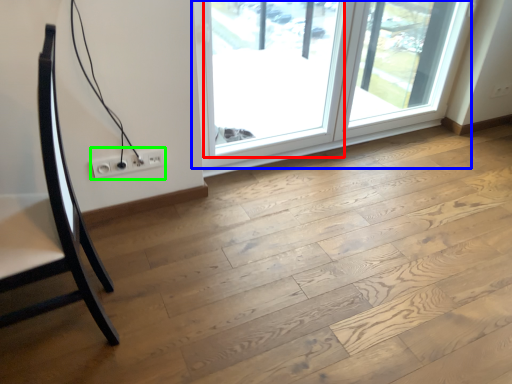
Question: Considering the real-world distances, which object is farthest from window (highlighted by a red box)? window (highlighted by a blue box) or electric outlet (highlighted by a green box)?

Choices:
 (A) window
 (B) electric outlet

Answer: (B)